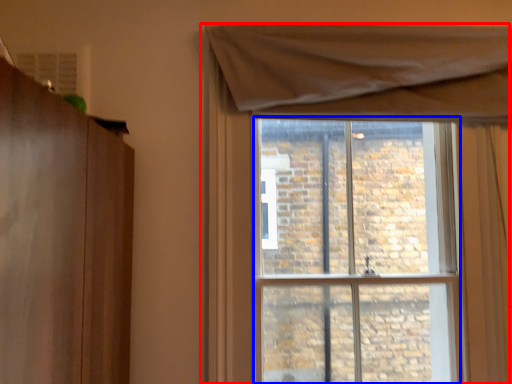
Question: Which object appears closest to the camera in this image, window (highlighted by a red box) or window screen (highlighted by a blue box)?

Choices:
 (A) window
 (B) window screen

Answer: (A)